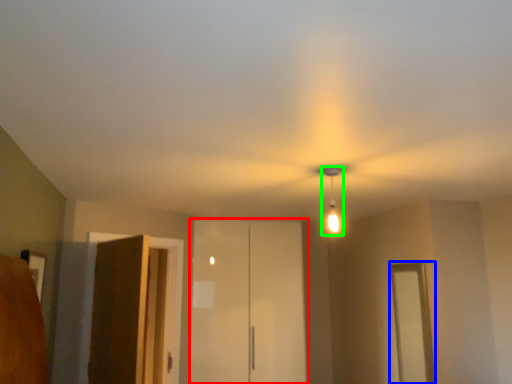
Question: Estimate the real-world distances between objects in this image. Which object is closer to elevator (highlighted by a red box), window (highlighted by a blue box) or light fixture (highlighted by a green box)?

Choices:
 (A) window
 (B) light fixture

Answer: (A)